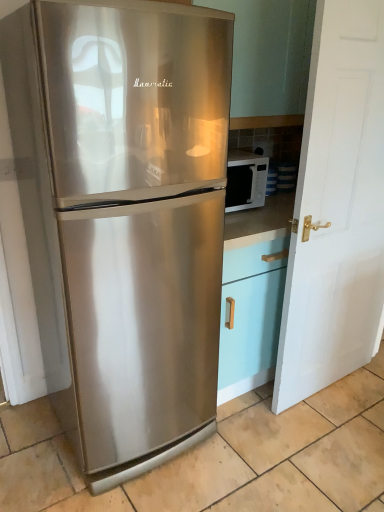
Question: Is white glossy microwave at right aimed at white matte door at right?

Choices:
 (A) yes
 (B) no

Answer: (A)

Question: Does white glossy microwave at right have a lesser height compared to white matte door at right?

Choices:
 (A) no
 (B) yes

Answer: (B)

Question: Is white glossy microwave at right smaller than white matte door at right?

Choices:
 (A) yes
 (B) no

Answer: (A)

Question: From a real-world perspective, is white glossy microwave at right on top of white matte door at right?

Choices:
 (A) no
 (B) yes

Answer: (B)

Question: Is white matte door at right inside white glossy microwave at right?

Choices:
 (A) yes
 (B) no

Answer: (B)

Question: In the image, is white matte door at right positioned in front of or behind white glossy microwave at right?

Choices:
 (A) front
 (B) behind

Answer: (A)

Question: Visually, is white matte door at right positioned to the left or to the right of white glossy microwave at right?

Choices:
 (A) left
 (B) right

Answer: (B)

Question: From the image's perspective, relative to white glossy microwave at right, is white matte door at right above or below?

Choices:
 (A) above
 (B) below

Answer: (B)

Question: Is point (345, 189) closer or farther from the camera than point (241, 207)?

Choices:
 (A) closer
 (B) farther

Answer: (A)

Question: Is white matte door at right wider or thinner than stainless steel refrigerator at left?

Choices:
 (A) thin
 (B) wide

Answer: (A)

Question: Is white matte door at right spatially inside stainless steel refrigerator at left, or outside of it?

Choices:
 (A) outside
 (B) inside

Answer: (A)

Question: From a real-world perspective, is white matte door at right physically located above or below stainless steel refrigerator at left?

Choices:
 (A) above
 (B) below

Answer: (A)

Question: Is white matte door at right in front of or behind stainless steel refrigerator at left in the image?

Choices:
 (A) front
 (B) behind

Answer: (B)

Question: Looking at the image, does white glossy microwave at right seem bigger or smaller compared to white matte door at right?

Choices:
 (A) small
 (B) big

Answer: (A)

Question: From the image's perspective, is white glossy microwave at right positioned above or below white matte door at right?

Choices:
 (A) above
 (B) below

Answer: (A)